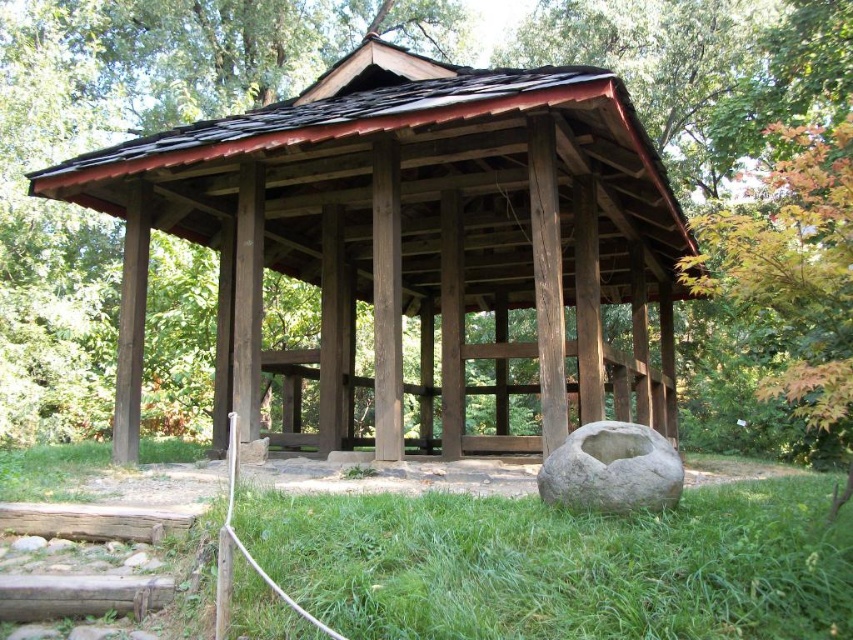
Does green grass at lower center have a lesser width compared to gray stone bowl at lower center?

Incorrect, green grass at lower center's width is not less than gray stone bowl at lower center's.

Which is behind, point (521, 595) or point (556, 460)?

Positioned behind is point (556, 460).

Does point (235, 563) come closer to viewer compared to point (654, 433)?

Yes, it is in front of point (654, 433).

I want to click on green grass at lower center, so click(561, 564).

Does brown wooden gazebo at center have a greater height compared to gray stone bowl at lower center?

Yes.

Does brown wooden gazebo at center come in front of gray stone bowl at lower center?

No, it is behind gray stone bowl at lower center.

What do you see at coordinates (408, 241) in the screenshot?
I see `brown wooden gazebo at center` at bounding box center [408, 241].

The height and width of the screenshot is (640, 853). In order to click on brown wooden gazebo at center in this screenshot , I will do `click(408, 241)`.

Is the position of brown wooden gazebo at center less distant than that of green grass at lower center?

No, it is not.

Can you confirm if brown wooden gazebo at center is shorter than green grass at lower center?

A: No, brown wooden gazebo at center is not shorter than green grass at lower center.

Is point (601, 244) closer to viewer compared to point (517, 554)?

That is False.

Find the location of a particular element. brown wooden gazebo at center is located at coordinates (408, 241).